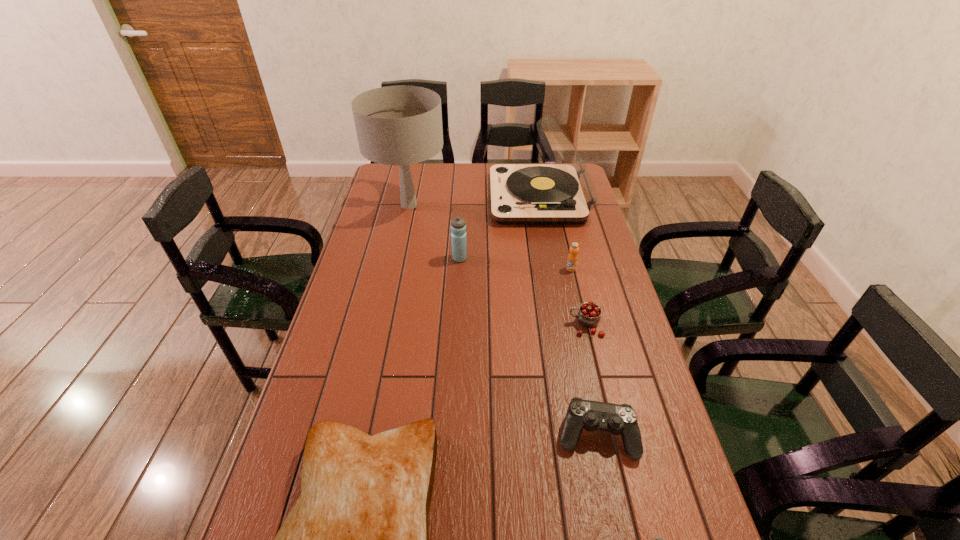
Find the location of `lampshade`. lampshade is located at coordinates (400, 125).

Identify the location of the second tallest object. This screenshot has width=960, height=540. (562, 192).

Locate an element on the screen. Image resolution: width=960 pixels, height=540 pixels. water bottle is located at coordinates (458, 225).

Identify the location of the third farthest object. (458, 225).

At what (x,y) coordinates should I click in order to perform the action: click on orange juice. Please return your answer as a coordinate pair (x, y). The height and width of the screenshot is (540, 960). Looking at the image, I should click on (572, 260).

I want to click on cherry, so click(x=589, y=313).

The width and height of the screenshot is (960, 540). Identify the location of control. (617, 419).

Where is `vacant space positioned 0.110m on the front-facing side of the tallest object`? The height and width of the screenshot is (540, 960). vacant space positioned 0.110m on the front-facing side of the tallest object is located at coordinates (400, 244).

Find the location of a particular element. free space located with the tonearm facing the front of the record player is located at coordinates (469, 198).

Where is `blank space located with the tonearm facing the front of the record player`? blank space located with the tonearm facing the front of the record player is located at coordinates (422, 198).